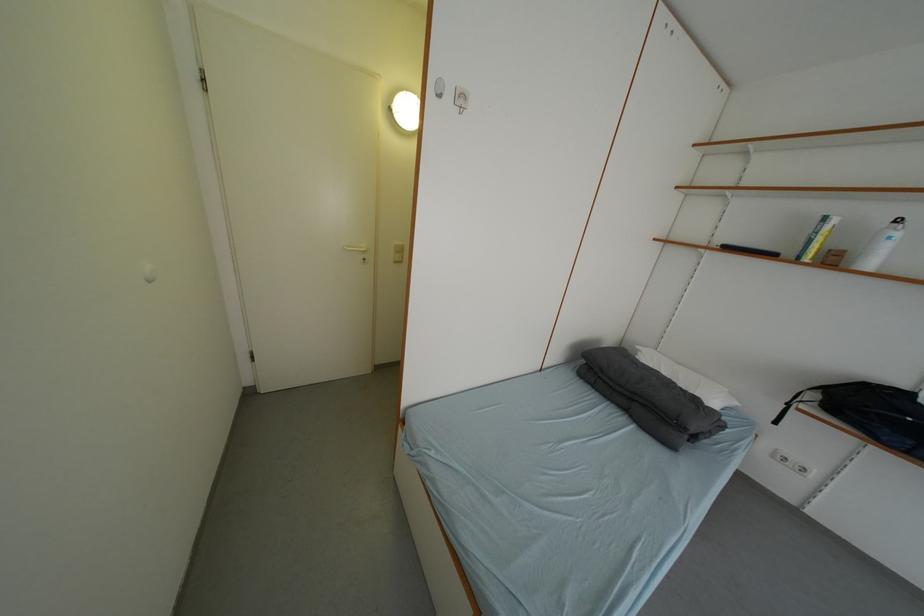
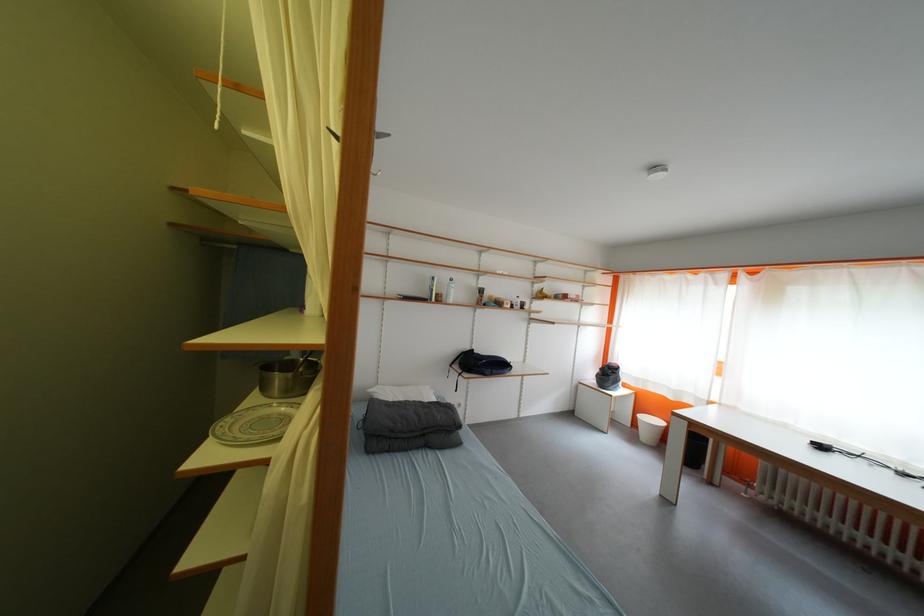
The point at [842,264] is marked in the first image. Where is the corresponding point in the second image?

(447, 302)